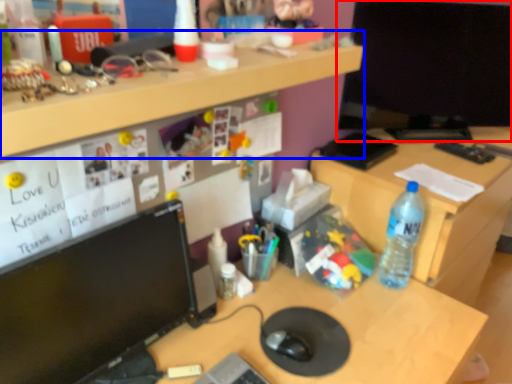
Question: Which of the following is the closest to the observer, computer monitor (highlighted by a red box) or desk (highlighted by a blue box)?

Choices:
 (A) computer monitor
 (B) desk

Answer: (B)